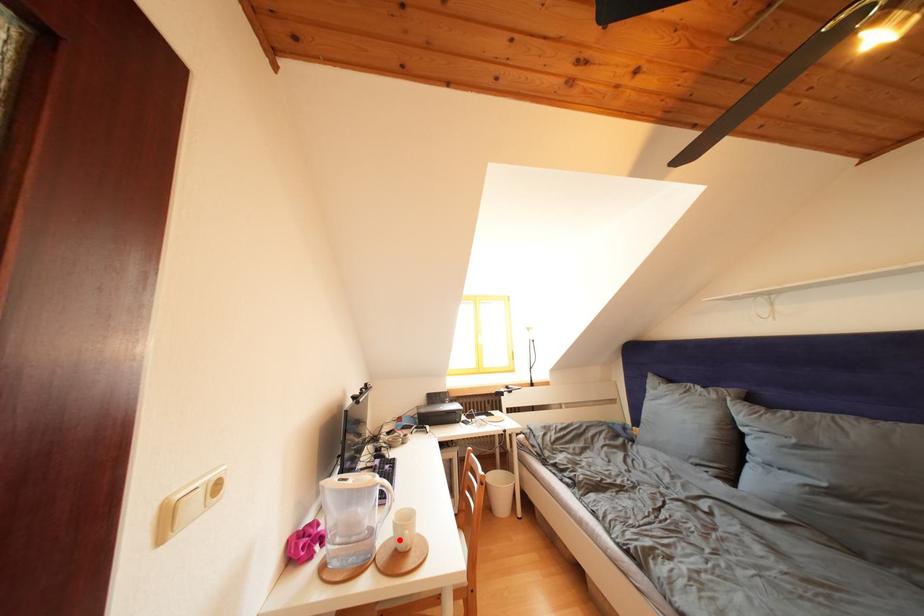
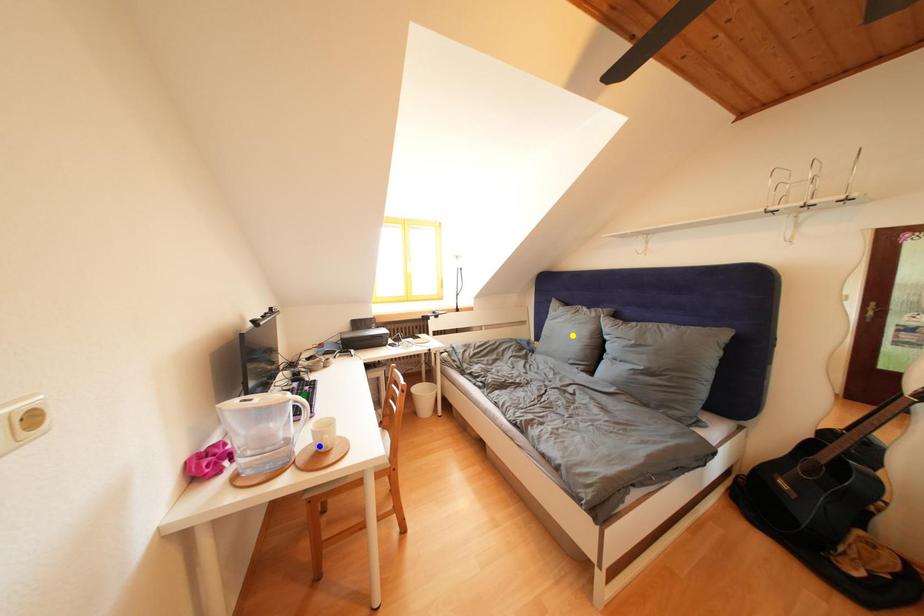
Question: I am providing you with two images of the same scene from different viewpoints. A red point is marked on the first image. You are given multiple points on the second image. Which point in image 2 represents the same 3d spot as the red point in image 1?

Choices:
 (A) blue point
 (B) green point
 (C) yellow point

Answer: (A)